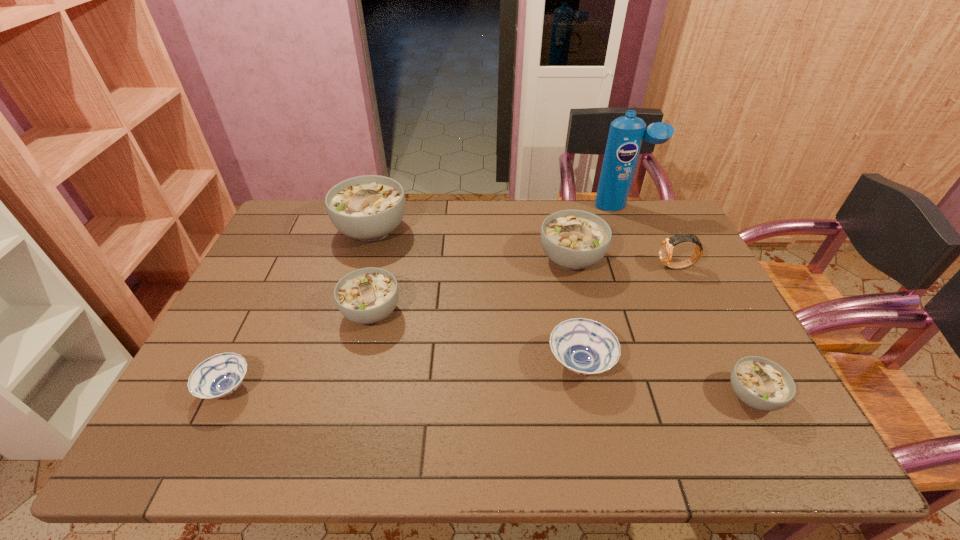
In order to click on the rightmost white soup bowl in this screenshot , I will do `click(760, 383)`.

The height and width of the screenshot is (540, 960). I want to click on the leftmost soup bowl, so click(x=220, y=375).

In order to click on the smaller blue soup bowl in this screenshot , I will do `click(220, 375)`.

Identify the location of free point located 0.170m on the left of the shampoo. pyautogui.click(x=548, y=206).

Find the location of a particular element. free space located 0.080m on the front of the biggest white soup bowl is located at coordinates click(x=360, y=271).

Locate an element on the screen. free region located on the left of the second biggest white soup bowl is located at coordinates (412, 259).

What are the coordinates of `free space located 0.250m on the face of the watch` in the screenshot? It's located at (577, 267).

Where is `free space located 0.240m on the face of the watch`? The width and height of the screenshot is (960, 540). free space located 0.240m on the face of the watch is located at coordinates (581, 267).

Where is `vacant region located 0.160m on the face of the watch`? The image size is (960, 540). vacant region located 0.160m on the face of the watch is located at coordinates (607, 267).

This screenshot has height=540, width=960. What are the coordinates of `free region located on the front of the fourth shortest soup bowl` in the screenshot? It's located at (340, 444).